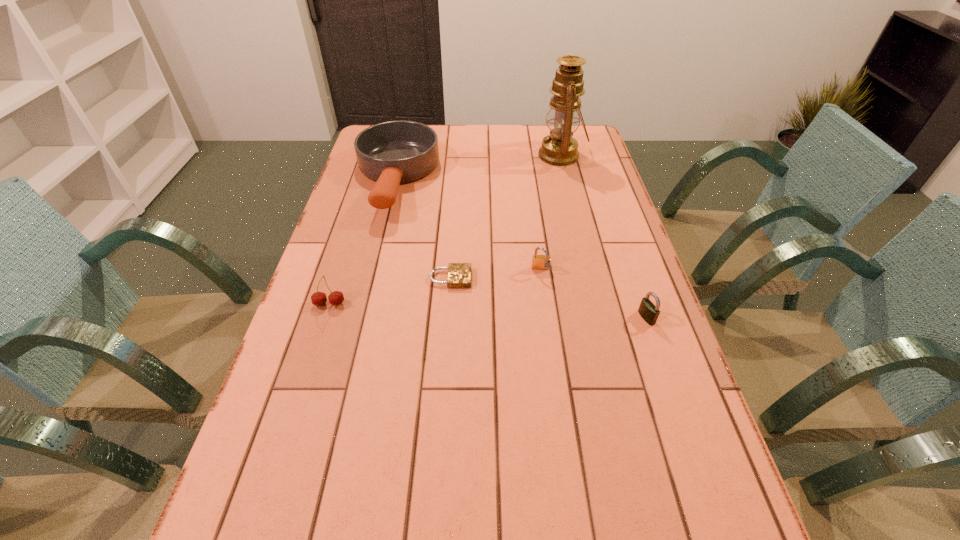
This screenshot has height=540, width=960. I want to click on padlock that is at the right edge, so click(x=648, y=311).

Locate an element on the screen. object that is positioned at the far left corner is located at coordinates (393, 152).

This screenshot has height=540, width=960. I want to click on object that is at the far right corner, so 559,148.

Where is `vacant area at the left edge`? This screenshot has height=540, width=960. vacant area at the left edge is located at coordinates (309, 306).

I want to click on free space at the right edge of the desktop, so click(738, 517).

Locate an element on the screen. Image resolution: width=960 pixels, height=540 pixels. blank region between the pan and the cherry is located at coordinates coord(363,242).

Identify the location of vacant space that is in between the third object from right to left and the pan. The image size is (960, 540). (468, 225).

Find the location of a particular element. This screenshot has width=960, height=540. unoccupied area between the cherry and the second padlock from left to right is located at coordinates (435, 287).

The width and height of the screenshot is (960, 540). Find the location of `free space between the second padlock from left to right and the second object from right to left`. free space between the second padlock from left to right and the second object from right to left is located at coordinates (551, 213).

Where is `vacant space that's between the pan and the cherry`? The width and height of the screenshot is (960, 540). vacant space that's between the pan and the cherry is located at coordinates (363, 242).